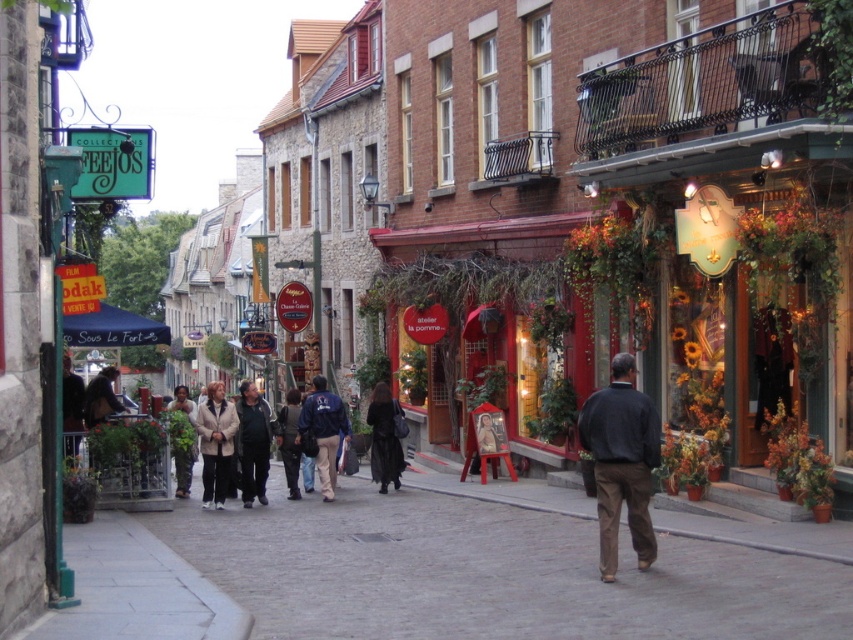
Question: Can you confirm if gray cobblestone pavement at center is positioned above dark blue jacket at center?

Choices:
 (A) no
 (B) yes

Answer: (A)

Question: Which is farther from the dark gray jacket at center?

Choices:
 (A) gray cobblestone pavement at center
 (B) dark gray sweater at center
 (C) dark blue jacket at center
 (D) light beige coat at center

Answer: (B)

Question: Is gray cobblestone pavement at center above dark gray sweater at center?

Choices:
 (A) no
 (B) yes

Answer: (A)

Question: Which object is closer to the camera taking this photo?

Choices:
 (A) dark blue jacket at center
 (B) dark gray jacket at center
 (C) light beige coat at center
 (D) dark gray sweater at center

Answer: (D)

Question: Observing the image, what is the correct spatial positioning of dark gray sweater at center in reference to dark gray jacket at center?

Choices:
 (A) below
 (B) above

Answer: (B)

Question: Which point is farther to the camera?

Choices:
 (A) (614, 392)
 (B) (252, 422)
 (C) (323, 492)

Answer: (C)